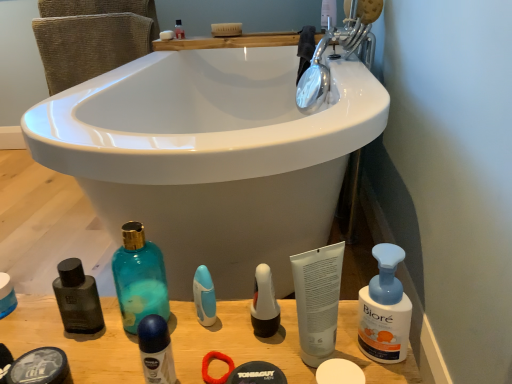
Locate an element on the screen. This screenshot has width=512, height=384. vacant space that is in between matte black bottle at lower left and blue matte deodorant at center, the 2th toiletry from the front is located at coordinates (68, 334).